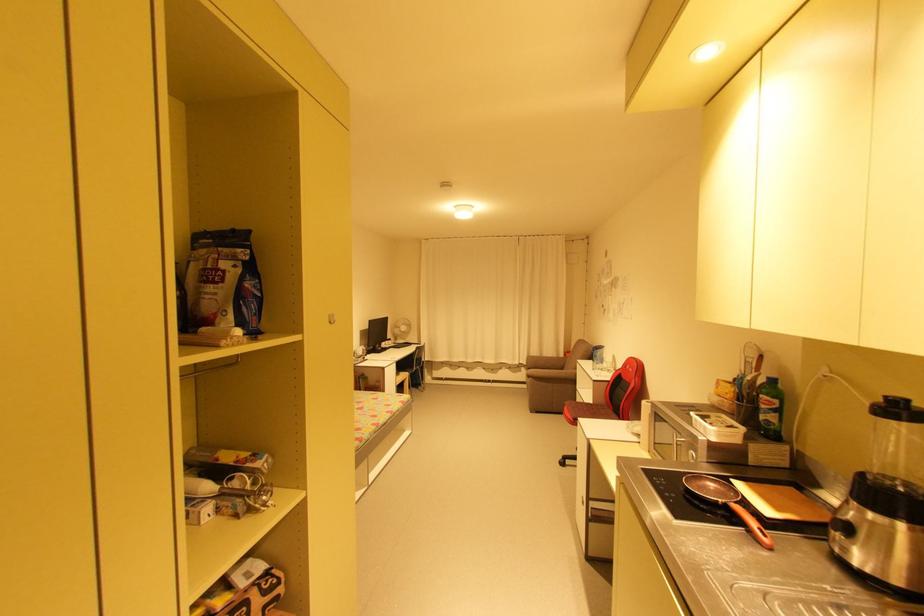
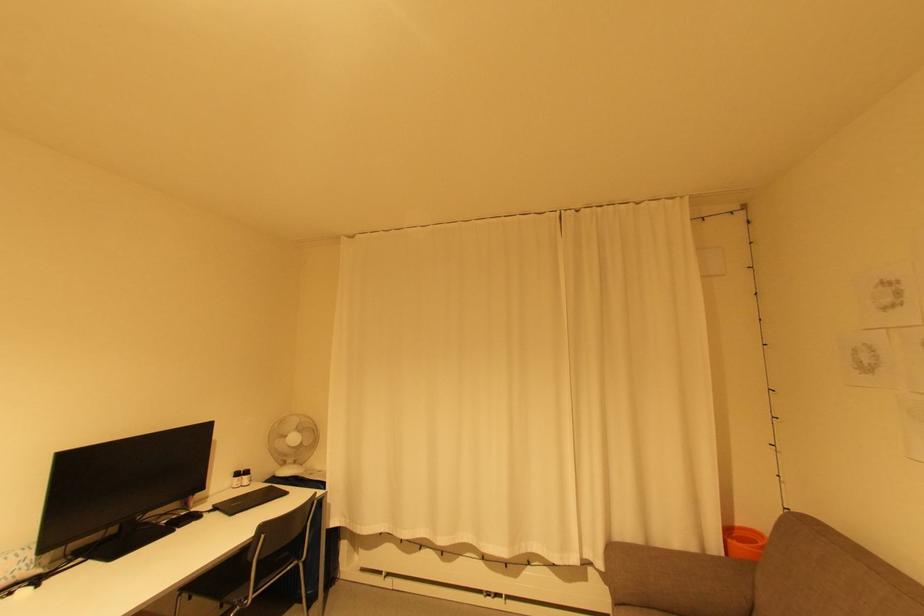
Locate, in the second image, the point that corresponds to the point at 407,329 in the first image.

(298, 439)